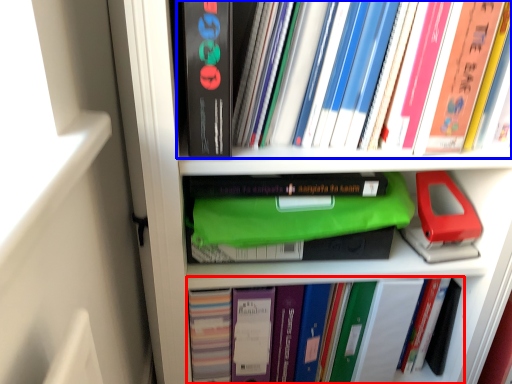
Question: Which point is closer to the camera, book (highlighted by a red box) or book (highlighted by a blue box)?

Choices:
 (A) book
 (B) book

Answer: (B)